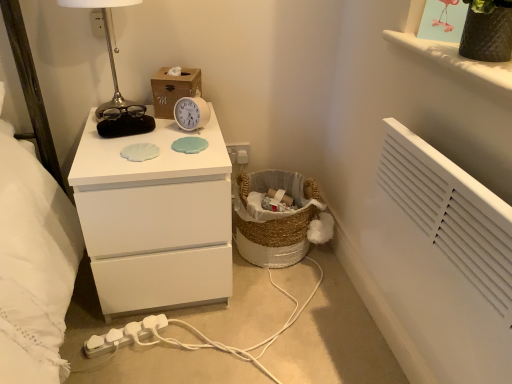
This screenshot has height=384, width=512. Find the location of `vacant area on top of white matte chest of drawers at center (from a real-world perspective)`. vacant area on top of white matte chest of drawers at center (from a real-world perspective) is located at coordinates (146, 144).